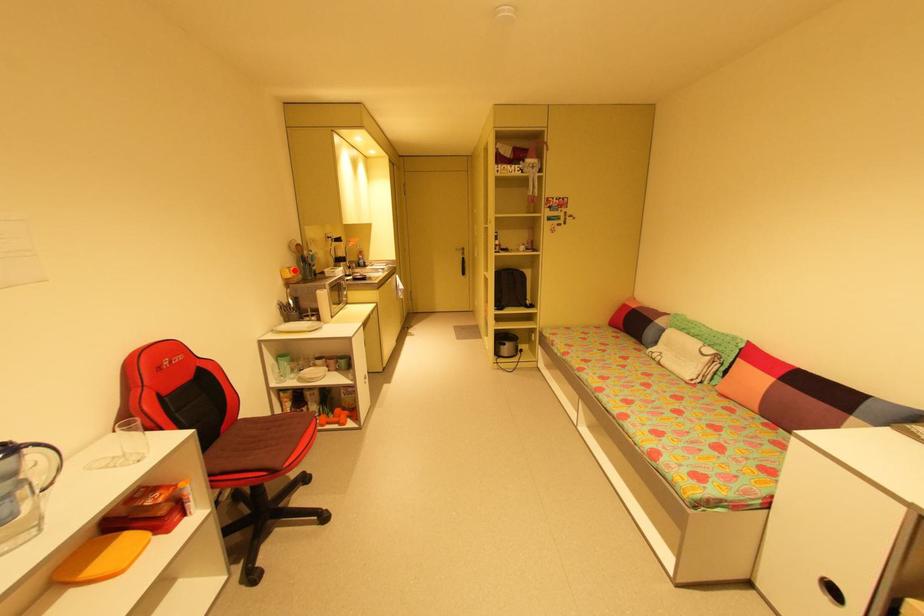
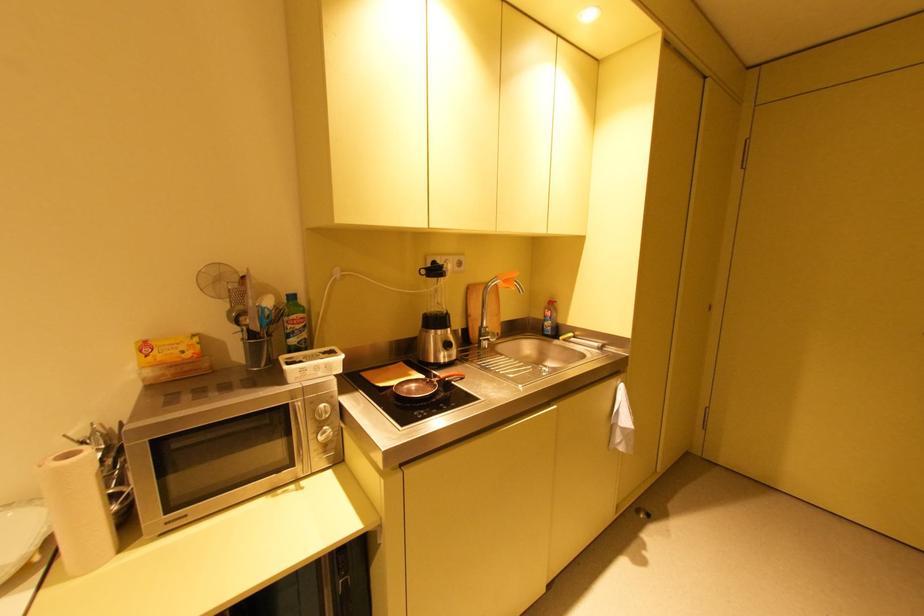
In the second image, find the point that corresponds to the highlighted location in the first image.

(150, 347)